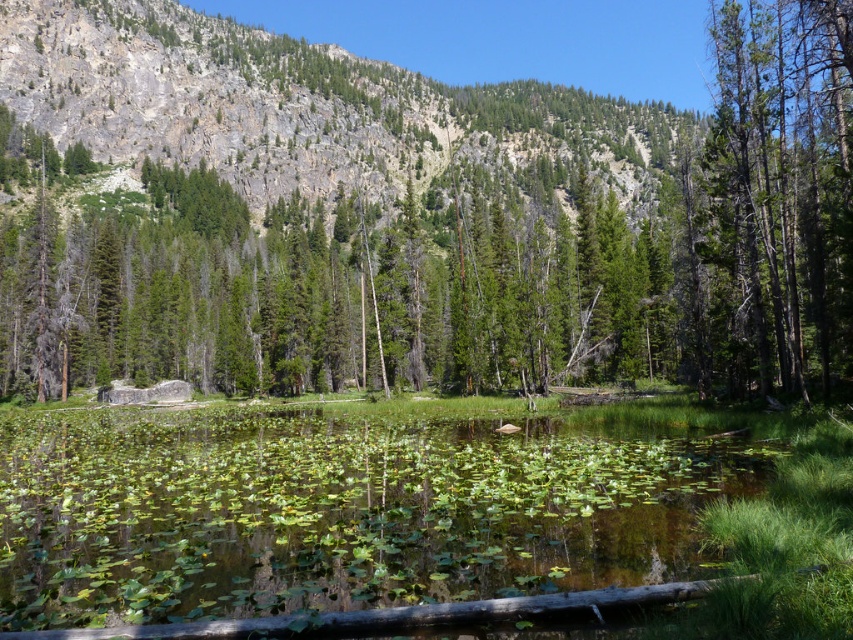
Find the location of `green leafy water at center`. green leafy water at center is located at coordinates (338, 509).

Who is more distant from viewer, [16,577] or [839,72]?

Point [839,72]

Identify the location of green leafy water at center. This screenshot has height=640, width=853. (x=338, y=509).

Looking at this image, is green leafy water at center shorter than green textured hillside at upper center?

Indeed, green leafy water at center has a lesser height compared to green textured hillside at upper center.

Find the location of `green leafy water at center`. green leafy water at center is located at coordinates (338, 509).

Where is `green leafy water at center`? green leafy water at center is located at coordinates [x=338, y=509].

Does green textured hillside at upper center appear over green matte tree at right?

Yes.

Does green textured hillside at upper center have a lesser height compared to green matte tree at right?

In fact, green textured hillside at upper center may be taller than green matte tree at right.

Is point (172, 124) farther from viewer compared to point (802, 60)?

That is True.

Where is `green textured hillside at upper center`? green textured hillside at upper center is located at coordinates [297, 106].